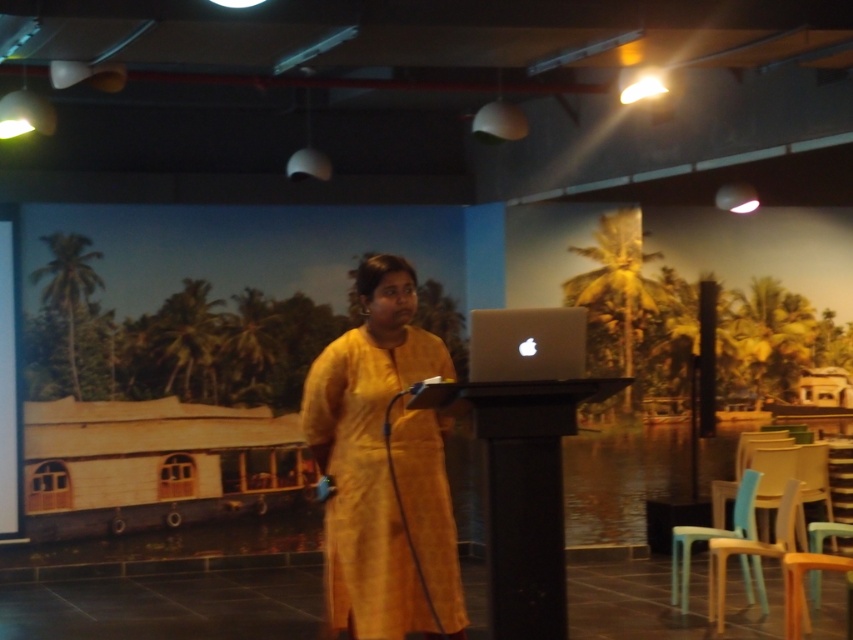
You are an event organizer setting up a presentation. You see the yellow textured dress at center and the silver metallic laptop at center. Which object is positioned lower in the scene?

The yellow textured dress at center is below the silver metallic laptop at center, so the yellow textured dress at center is positioned lower in the scene.

You are an event organizer setting up a presentation. You need to ensure that the yellow textured dress at center does not block the audience from seeing the silver metallic laptop at center. Based on their sizes, is this a concern?

The yellow textured dress at center is wider than the silver metallic laptop at center, so there is a possibility that the dress could block the audience from seeing the laptop if not positioned carefully.

You are a photographer standing behind the podium. You want to take a photo of the speaker wearing the yellow textured dress at center and the silver metallic laptop at center. What is the minimum distance you need to move backward to ensure both objects are in frame?

The minimum distance you need to move backward is 22.59 inches to ensure both the yellow textured dress at center and the silver metallic laptop at center are in frame since they are 22.59 inches apart.